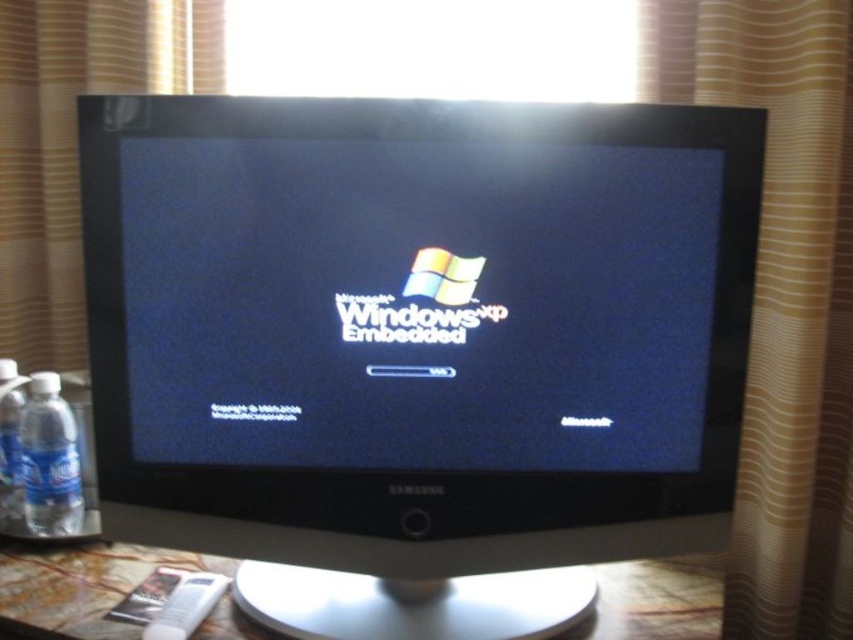
Does beige fabric curtain at right appear under clear plastic water bottle at left?

No, beige fabric curtain at right is not below clear plastic water bottle at left.

Is point (849, 592) behind point (3, 424)?

No, it is not.

Image resolution: width=853 pixels, height=640 pixels. In order to click on beige fabric curtain at right in this screenshot , I will do `click(782, 296)`.

Is point (728, 218) positioned after point (788, 184)?

No, it is in front of (788, 184).

Based on the photo, does satin black monitor at center have a lesser width compared to beige fabric curtain at right?

No, satin black monitor at center is not thinner than beige fabric curtain at right.

Between point (358, 189) and point (741, 29), which one is positioned behind?

The point (741, 29) is more distant.

You are a GUI agent. You are given a task and a screenshot of the screen. Output one action in this format:
    pyautogui.click(x=<x>, y=<y>)
    Task: Click on the satin black monitor at center
    
    Given the screenshot: What is the action you would take?
    pyautogui.click(x=416, y=346)

Based on the photo, does beige fabric curtain at right appear on the right side of marble table at center?

Correct, you'll find beige fabric curtain at right to the right of marble table at center.

Between beige fabric curtain at right and marble table at center, which one has less height?

With less height is marble table at center.

Consider the image. Measure the distance between point (840, 61) and camera.

The distance of point (840, 61) from camera is 95.40 centimeters.

In order to click on beige fabric curtain at right in this screenshot , I will do `click(782, 296)`.